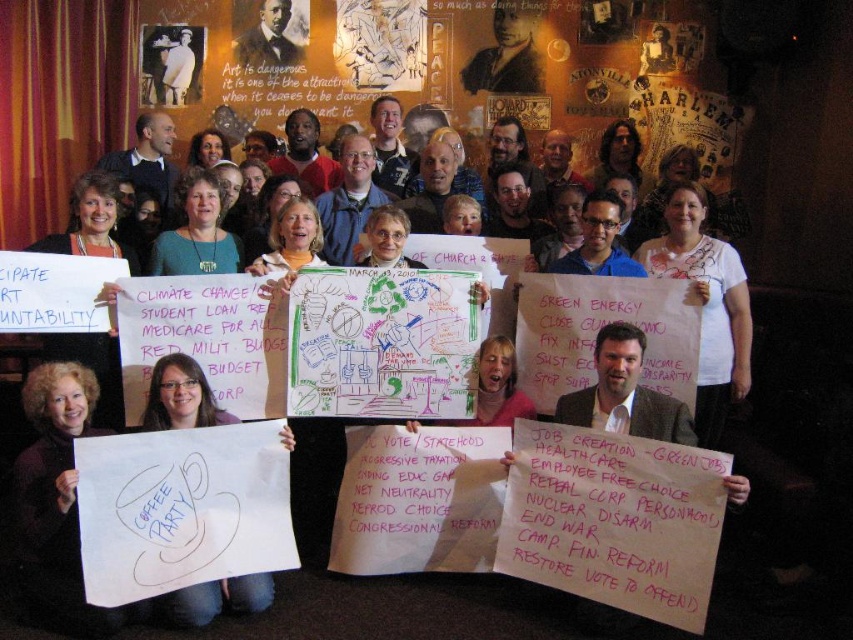
Question: Is smooth black suit at upper center wider than white cotton shirt at upper left?

Choices:
 (A) yes
 (B) no

Answer: (A)

Question: Is white paper at lower left smaller than smooth black suit at upper center?

Choices:
 (A) yes
 (B) no

Answer: (A)

Question: Is matte black suit at center closer to the viewer compared to smooth black suit at upper center?

Choices:
 (A) yes
 (B) no

Answer: (A)

Question: Which point is closer to the camera?

Choices:
 (A) white cotton shirt at upper left
 (B) white paper at center
 (C) white paper at lower left

Answer: (C)

Question: Estimate the real-world distances between objects in this image. Which object is farther from the matte black suit at center?

Choices:
 (A) white cotton shirt at upper left
 (B) smooth black suit at upper center
 (C) white paper at lower left
 (D) white paper at center

Answer: (C)

Question: Which object appears farthest from the camera in this image?

Choices:
 (A) matte black suit at center
 (B) smooth black suit at upper center

Answer: (B)